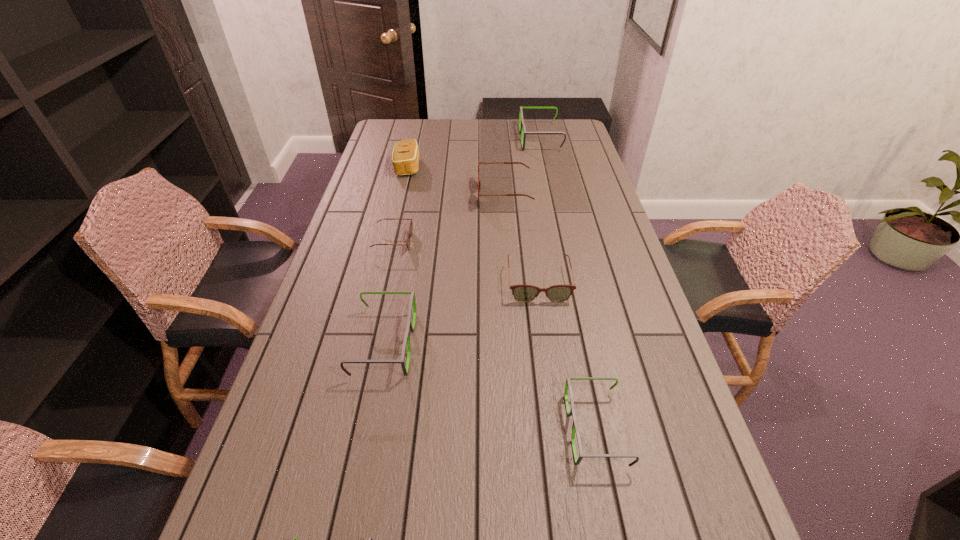
Where is `free location at the far edge of the desktop`? The height and width of the screenshot is (540, 960). free location at the far edge of the desktop is located at coordinates (531, 129).

The image size is (960, 540). In the image, there is a desktop. Identify the location of vacant space at the left edge. (258, 444).

Where is `vacant space at the right edge of the desktop`? This screenshot has width=960, height=540. vacant space at the right edge of the desktop is located at coordinates (580, 224).

The image size is (960, 540). What are the coordinates of `unoccupied position between the farthest black spectacles and the second farthest spectacles` in the screenshot? It's located at (522, 167).

Image resolution: width=960 pixels, height=540 pixels. I want to click on free spot between the fifth nearest object and the clutch bag, so click(400, 204).

This screenshot has width=960, height=540. Identify the location of vacant area between the fifth farthest spectacles and the second nearest spectacles. (490, 386).

Identify the location of empty space between the seventh farthest object and the brown clutch bag. (502, 298).

Image resolution: width=960 pixels, height=540 pixels. What are the coordinates of `free area in between the fourth nearest spectacles and the leftmost brown spectacles` in the screenshot? It's located at (466, 262).

You are a GUI agent. You are given a task and a screenshot of the screen. Output one action in this format:
    pyautogui.click(x=<x>, y=<y>)
    Task: Click on the free space that is in between the second farthest object and the third nearest spectacles
    The width and height of the screenshot is (960, 540).
    Given the screenshot: What is the action you would take?
    pyautogui.click(x=396, y=255)

Where is `free space between the second farthest spectacles and the farthest black spectacles`? This screenshot has height=540, width=960. free space between the second farthest spectacles and the farthest black spectacles is located at coordinates (522, 167).